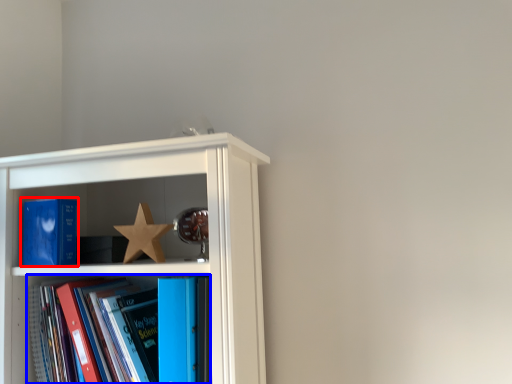
Question: Which object is further to the camera taking this photo, book (highlighted by a red box) or book (highlighted by a blue box)?

Choices:
 (A) book
 (B) book

Answer: (A)